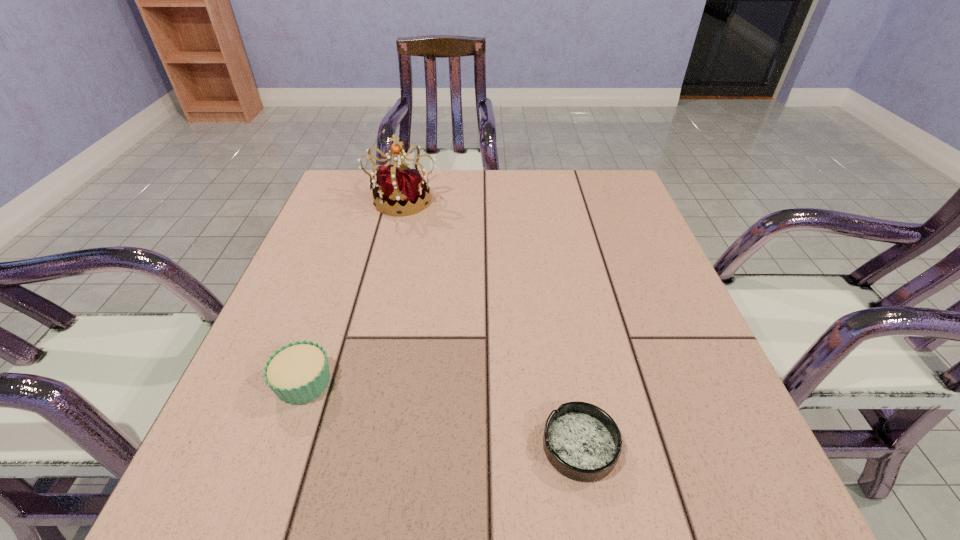
This screenshot has height=540, width=960. What are the coordinates of `object positioned at the near edge` in the screenshot? It's located at click(581, 441).

The width and height of the screenshot is (960, 540). In order to click on tiara that is at the left edge in this screenshot , I will do pyautogui.click(x=402, y=189).

Where is `cupcake located in the left edge section of the desktop`? cupcake located in the left edge section of the desktop is located at coordinates (297, 373).

Identify the location of object at the far left corner. (402, 189).

Where is `free region at the far edge of the desktop`? free region at the far edge of the desktop is located at coordinates (555, 207).

The width and height of the screenshot is (960, 540). I want to click on vacant region at the left edge of the desktop, so point(341,249).

Where is `vacant space at the right edge of the desktop`? This screenshot has width=960, height=540. vacant space at the right edge of the desktop is located at coordinates (616, 260).

Locate an element on the screen. The height and width of the screenshot is (540, 960). free space at the far left corner of the desktop is located at coordinates (339, 198).

The image size is (960, 540). Find the location of `vacant space at the far right corner of the desktop`. vacant space at the far right corner of the desktop is located at coordinates (580, 207).

Identify the location of vacant space that is in between the nearest object and the second farthest object. (442, 414).